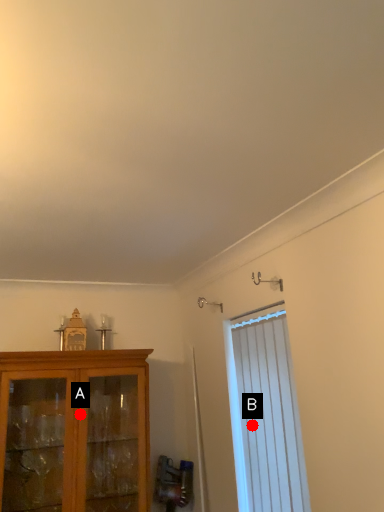
Question: Two points are circled on the image, labeled by A and B beside each circle. Among these points, which one is farthest from the camera?

Choices:
 (A) A is further
 (B) B is further

Answer: (A)